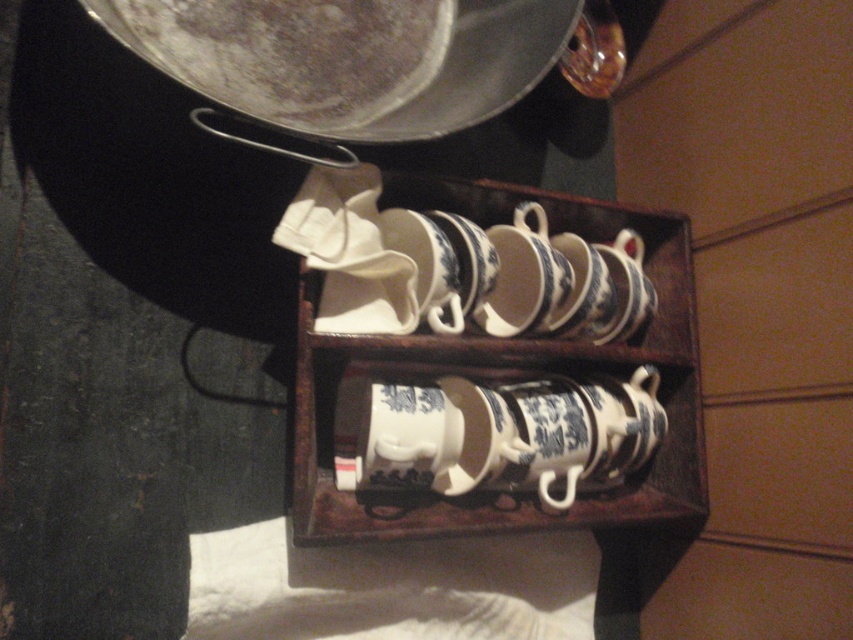
Between point (467, 60) and point (613, 365), which one is positioned in front?

Positioned in front is point (467, 60).

Which is below, shiny silver frying pan at upper center or blue and white porcelain cups at center?

blue and white porcelain cups at center

Does point (126, 4) come behind point (677, 467)?

No, it is in front of (677, 467).

Identify the location of shiny silver frying pan at upper center. (349, 58).